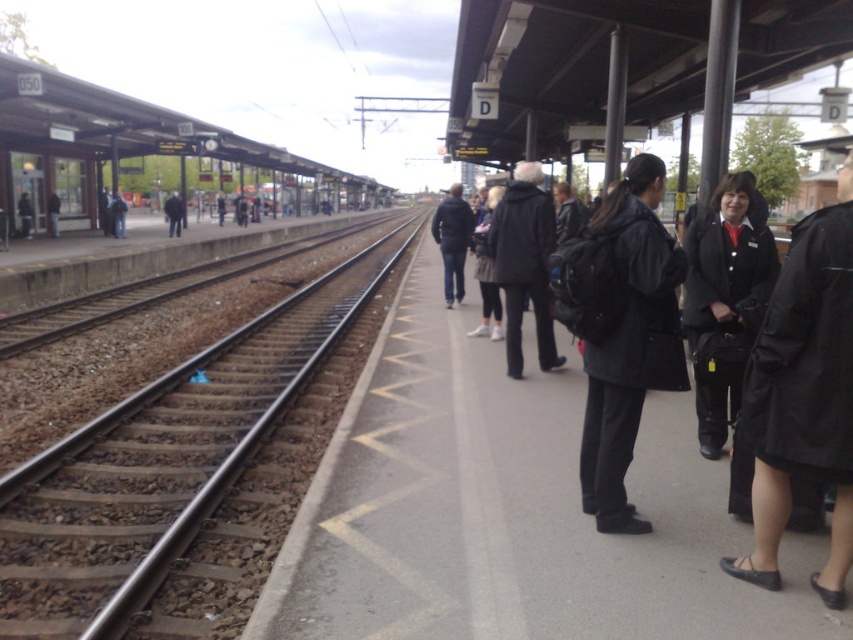
Does smooth steel tracks at center have a lesser height compared to dark gray coat at center?

No, smooth steel tracks at center is not shorter than dark gray coat at center.

Is smooth steel tracks at center smaller than dark gray coat at center?

Incorrect, smooth steel tracks at center is not smaller in size than dark gray coat at center.

Who is more forward, [334,339] or [553,333]?

Point [553,333] is more forward.

Where is `smooth steel tracks at center`? The height and width of the screenshot is (640, 853). smooth steel tracks at center is located at coordinates (175, 468).

This screenshot has width=853, height=640. Identify the location of black matte coat at right. (804, 396).

Can you confirm if black matte coat at right is thinner than dark gray coat at center?

Yes.

Between point (772, 348) and point (527, 168), which one is positioned in front?

Point (772, 348)

You are a GUI agent. You are given a task and a screenshot of the screen. Output one action in this format:
    pyautogui.click(x=<x>, y=<y>)
    Task: Click on the black matte coat at right
    
    Given the screenshot: What is the action you would take?
    pyautogui.click(x=804, y=396)

Which of these two, smooth steel tracks at center or matte black backpack at center, stands shorter?

matte black backpack at center is shorter.

Is point (61, 618) positioned in front of point (641, 285)?

No, (61, 618) is behind (641, 285).

The image size is (853, 640). Identify the location of smooth steel tracks at center. (175, 468).